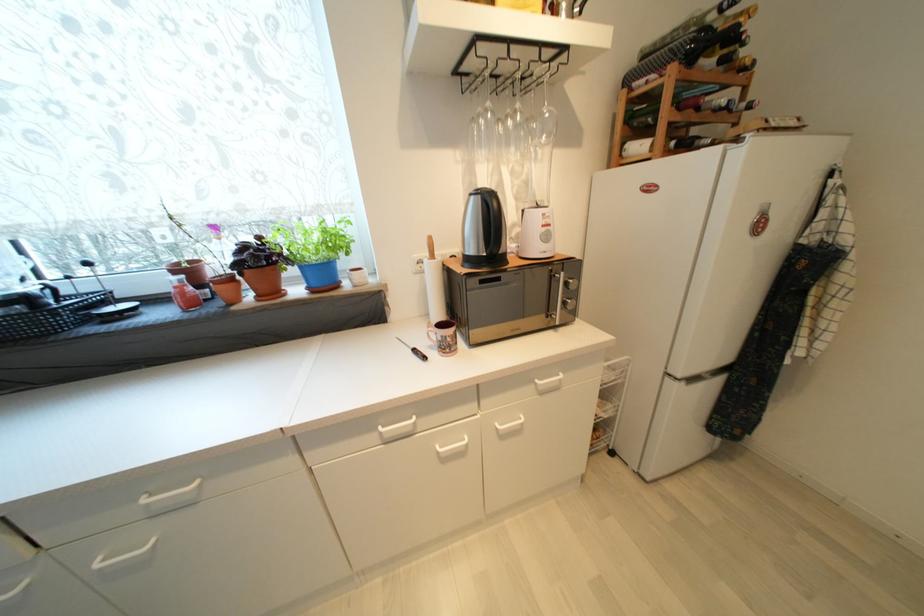
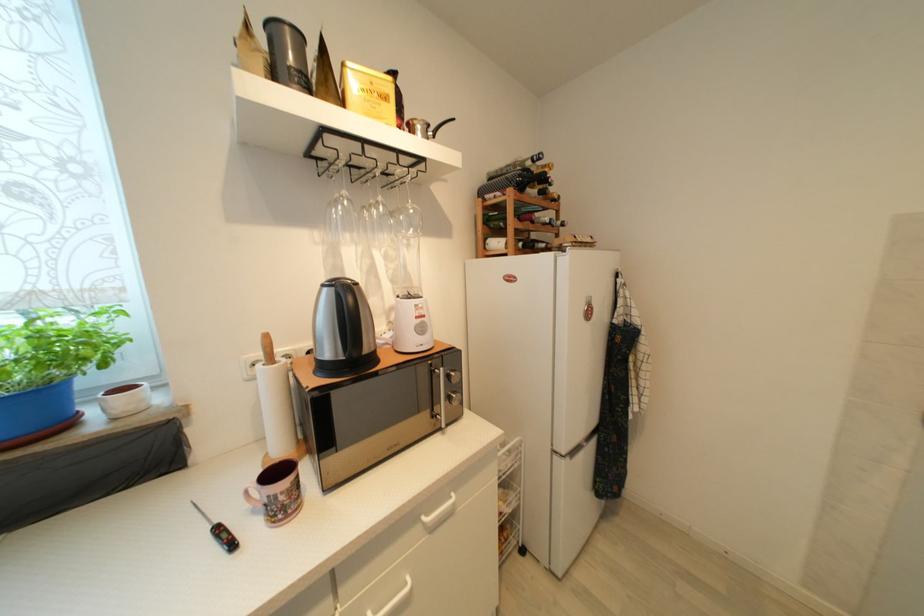
Find the pixel in the second image that matches (x=687, y=385) in the first image.

(573, 461)